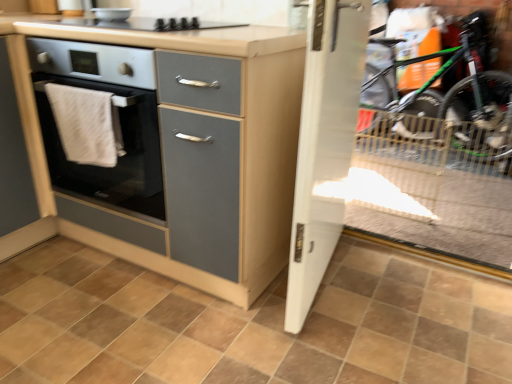
Identify the location of vacant position to the left of white glossy door at center. This screenshot has height=384, width=512. (202, 318).